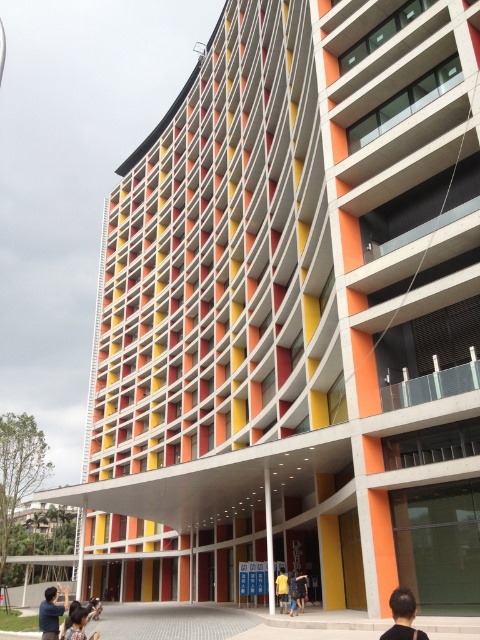
You are standing at the entrance of the building and notice two people in the scene. One has black hair at lower center and the other is wearing a yellow casual shirt at center. Which person is standing closer to the entrance?

The black hair at lower center is above the yellow casual shirt at center, meaning the person with black hair at lower center is closer to the entrance.

Consider the image. You are standing in front of the modern multi story building and see the dark blue shirt at lower left and dark brown hair at lower left. Which one is taller?

The dark blue shirt at lower left is much taller as dark brown hair at lower left.